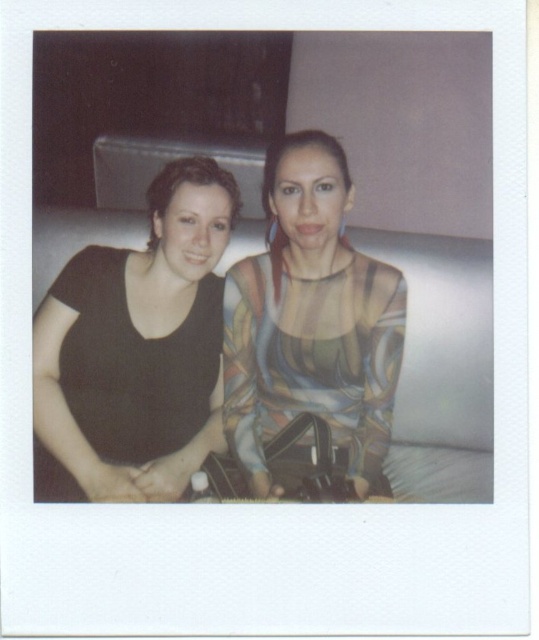
You are trying to decide whether to place a new decorative item on the black matte shirt at left or the white fabric couch at center. Based on their sizes, which object would be a better choice for placing a larger decorative item?

The black matte shirt at left has a larger size compared to the white fabric couch at center, so it would be a better choice for placing a larger decorative item.

You are arranging a photo album and need to describe the positions of the objects in the image. Which object is positioned to the left of the other between the translucent multicolored top at center and the white fabric couch at center?

The translucent multicolored top at center is to the left of the white fabric couch at center.